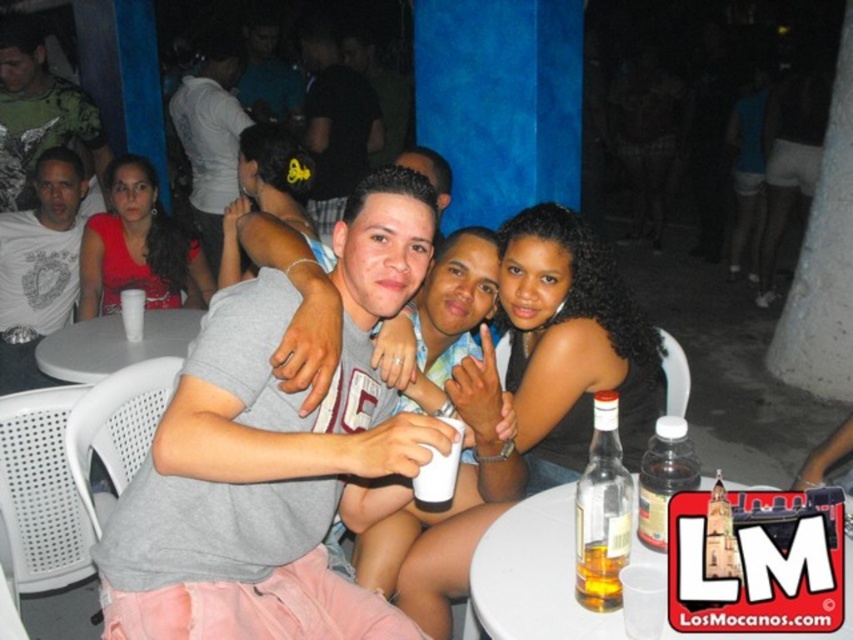
The height and width of the screenshot is (640, 853). What do you see at coordinates (270, 196) in the screenshot? I see `light gray fabric hairband at upper center` at bounding box center [270, 196].

Between light gray fabric hairband at upper center and white plastic table at center, which one has less height?

white plastic table at center is shorter.

Which is behind, point (242, 214) or point (132, 346)?

The point (132, 346) is more distant.

This screenshot has width=853, height=640. I want to click on light gray fabric hairband at upper center, so (270, 196).

Does white printed t-shirt at left have a greater width compared to matte red dress at left?

No, white printed t-shirt at left is not wider than matte red dress at left.

Can you confirm if white printed t-shirt at left is bigger than matte red dress at left?

Indeed, white printed t-shirt at left has a larger size compared to matte red dress at left.

Find the location of `white printed t-shirt at left`. white printed t-shirt at left is located at coordinates (39, 268).

Does point (229, 636) come behind point (674, 637)?

Yes, it is behind point (674, 637).

Who is more distant from viewer, (202, 401) or (532, 566)?

The point (532, 566) is more distant.

Locate an element on the screen. gray cotton shirt at center is located at coordinates (271, 456).

Identify the location of gray cotton shirt at center. The height and width of the screenshot is (640, 853). (271, 456).